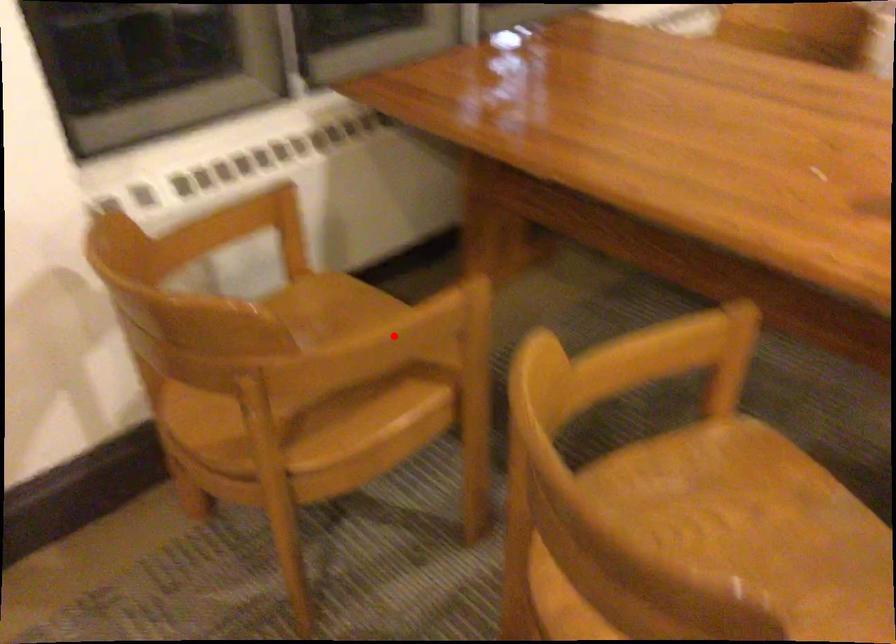
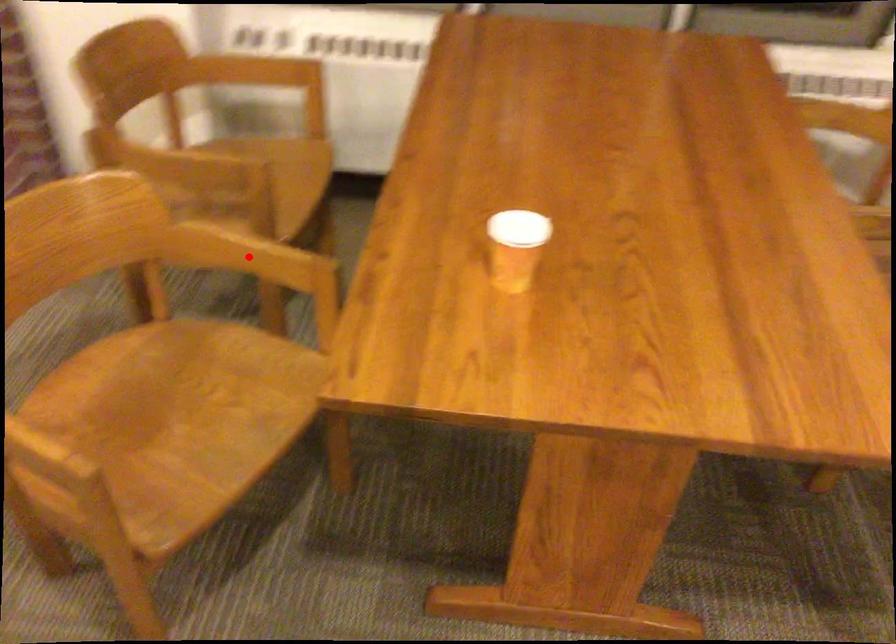
I am providing you with two images of the same scene from different viewpoints. A red point is marked on the first image and another point is marked on the second image. Is the marked point in image1 the same physical position as the marked point in image2?

No